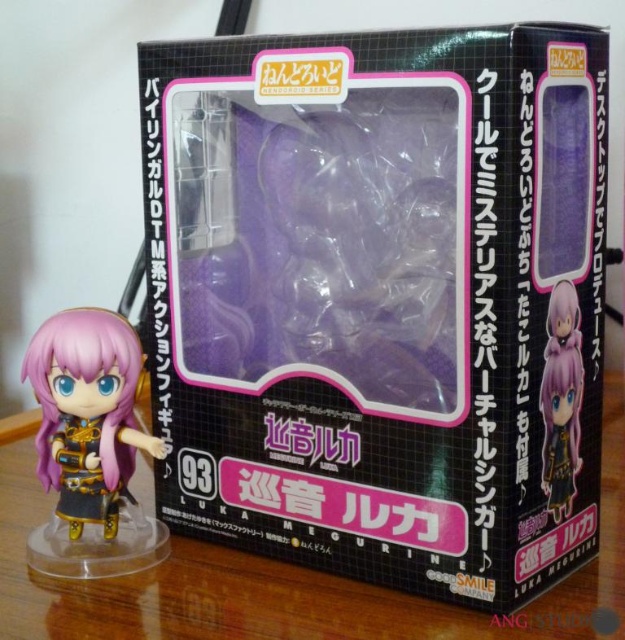
Can you confirm if matte black figure at lower left is thinner than satin purple figurine at lower right?

Incorrect, matte black figure at lower left's width is not less than satin purple figurine at lower right's.

Consider the image. Is matte black figure at lower left in front of satin purple figurine at lower right?

That is False.

Who is more distant from viewer, (86, 356) or (562, 429)?

The point (562, 429) is behind.

The image size is (625, 640). I want to click on matte black figure at lower left, so click(x=88, y=413).

Can you confirm if transparent plastic table at lower center is shorter than matte black figure at lower left?

Correct, transparent plastic table at lower center is not as tall as matte black figure at lower left.

Which is more to the right, transparent plastic table at lower center or matte black figure at lower left?

transparent plastic table at lower center

Is point (202, 618) positioned in front of point (101, 445)?

Yes, it is.

In order to click on transparent plastic table at lower center in this screenshot , I will do `click(290, 582)`.

Does transparent plastic figure at center appear on the left side of matte black figure at lower left?

Incorrect, transparent plastic figure at center is not on the left side of matte black figure at lower left.

Which of these two, transparent plastic figure at center or matte black figure at lower left, stands taller?

With more height is transparent plastic figure at center.

Does point (338, 81) lie in front of point (40, 449)?

Yes.

Locate an element on the screen. transparent plastic figure at center is located at coordinates (376, 296).